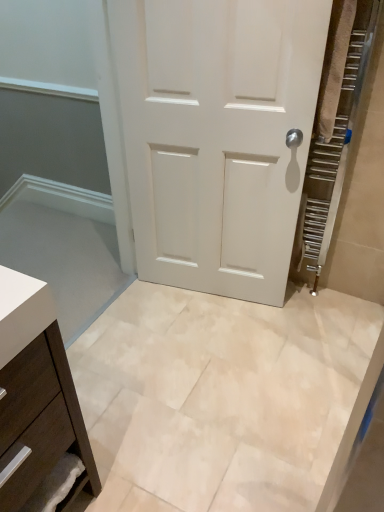
Question: From a real-world perspective, is beige marble tile at center above or below white matte door at center?

Choices:
 (A) above
 (B) below

Answer: (B)

Question: Considering the relative positions of beige marble tile at center and white matte door at center in the image provided, is beige marble tile at center to the left or to the right of white matte door at center?

Choices:
 (A) left
 (B) right

Answer: (A)

Question: Based on their relative distances, which object is nearer to the beige marble tile at center?

Choices:
 (A) matte brown drawer at lower left
 (B) white matte door at center

Answer: (B)

Question: Which of these objects is positioned closest to the matte brown drawer at lower left?

Choices:
 (A) beige marble tile at center
 (B) white matte door at center

Answer: (A)